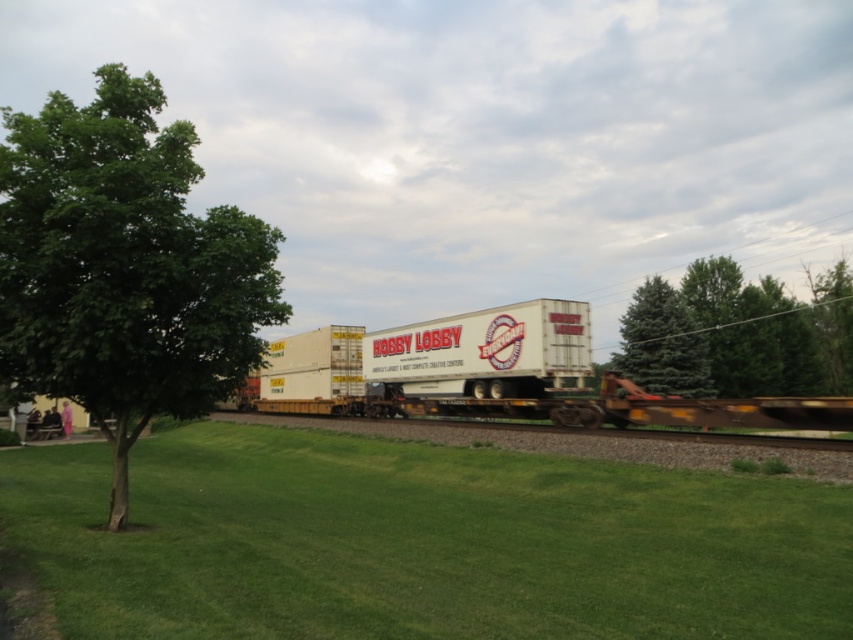
Can you confirm if green grass at center is wider than green fir tree at right?

Correct, the width of green grass at center exceeds that of green fir tree at right.

Is green grass at center smaller than green fir tree at right?

Correct, green grass at center occupies less space than green fir tree at right.

Image resolution: width=853 pixels, height=640 pixels. In order to click on green grass at center in this screenshot , I will do `click(421, 541)`.

This screenshot has height=640, width=853. Identify the location of green grass at center. (421, 541).

Can you confirm if green leafy tree at right is positioned above green leafy tree at upper right?

No, green leafy tree at right is not above green leafy tree at upper right.

Does green leafy tree at right appear on the right side of green leafy tree at upper right?

No, green leafy tree at right is not to the right of green leafy tree at upper right.

Is point (740, 348) positioned behind point (843, 321)?

No.

Find the location of a particular element. green leafy tree at right is located at coordinates (737, 333).

Who is more forward, (62, 120) or (741, 300)?

Positioned in front is point (62, 120).

Looking at this image, who is higher up, green leafy tree at left or green leafy tree at right?

Positioned higher is green leafy tree at left.

Identify the location of green leafy tree at left. (125, 266).